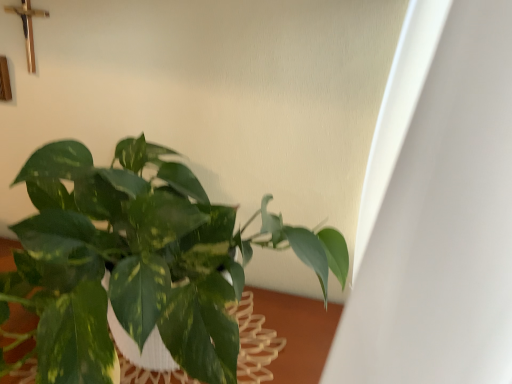
Describe the element at coordinates (137, 263) in the screenshot. This screenshot has height=384, width=512. I see `green glossy leafy plant at center-left` at that location.

You are a GUI agent. You are given a task and a screenshot of the screen. Output one action in this format:
    pyautogui.click(x=<x>, y=<y>)
    Task: Click on the green glossy leafy plant at center-left
    The image size is (512, 384).
    Given the screenshot: What is the action you would take?
    pyautogui.click(x=137, y=263)

Find the location of a particular element. The image size is (512, 384). green glossy leafy plant at center-left is located at coordinates (137, 263).